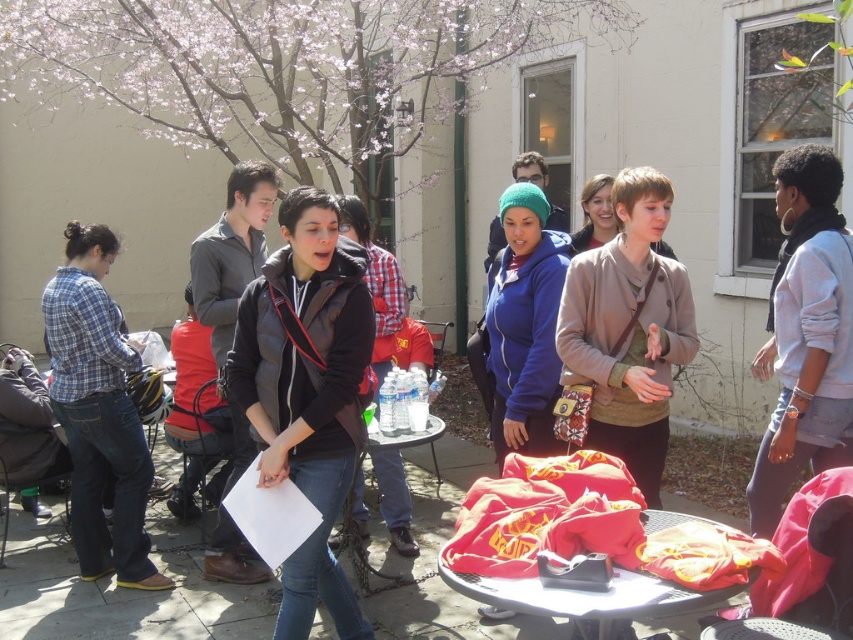
Question: Can you confirm if black matte vest at center is wider than red fabric table at center?

Choices:
 (A) no
 (B) yes

Answer: (A)

Question: Is light blue denim jacket at upper right further to the viewer compared to plaid cotton shirt at left?

Choices:
 (A) no
 (B) yes

Answer: (A)

Question: Which object is closer to the camera taking this photo?

Choices:
 (A) light blue denim jacket at upper right
 (B) black matte vest at center
 (C) red fabric table at center

Answer: (C)

Question: Which object is positioned farthest from the matte brown jacket at center?

Choices:
 (A) black matte vest at center
 (B) plaid cotton shirt at left

Answer: (B)

Question: Considering the relative positions of matte brown jacket at center and light blue denim jacket at upper right in the image provided, where is matte brown jacket at center located with respect to light blue denim jacket at upper right?

Choices:
 (A) below
 (B) above

Answer: (A)

Question: Which point is farther from the camera taking this photo?

Choices:
 (A) (308, 458)
 (B) (666, 275)

Answer: (B)